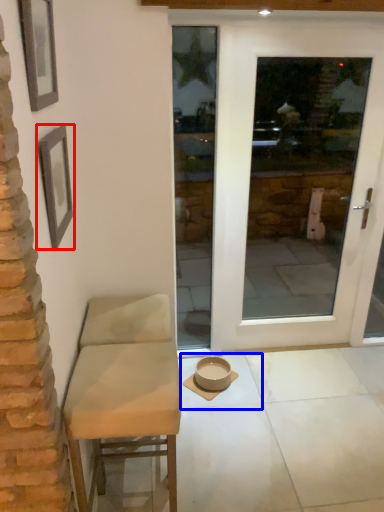
Question: Which object is closer to the camera taking this photo, picture frame (highlighted by a red box) or tile (highlighted by a blue box)?

Choices:
 (A) picture frame
 (B) tile

Answer: (A)